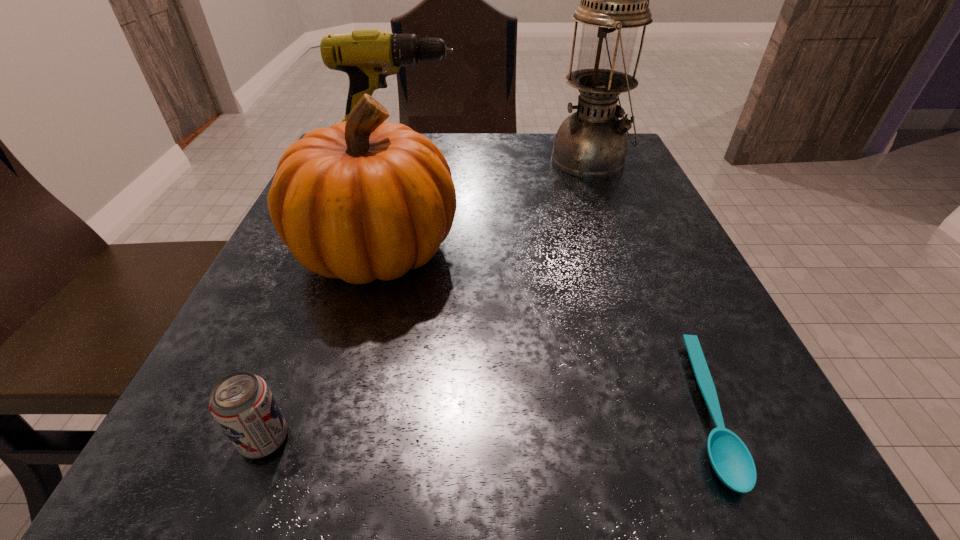
Where is `object that is the third closest to the spoon`? Image resolution: width=960 pixels, height=540 pixels. object that is the third closest to the spoon is located at coordinates (242, 404).

Find the location of `object that is the closest to the third nearest object`. object that is the closest to the third nearest object is located at coordinates (368, 56).

Identify the location of free location that satisfies the following two spatial constraints: 1. on the handle side of the drill; 2. on the back side of the spoon. (326, 410).

This screenshot has height=540, width=960. What are the coordinates of `free spot that satisfies the following two spatial constraints: 1. on the back side of the third farthest object; 2. on the handle side of the drill` in the screenshot? It's located at (402, 156).

You are a GUI agent. You are given a task and a screenshot of the screen. Output one action in this format:
    pyautogui.click(x=<x>, y=<y>)
    Task: Click on the vacant region that satisfies the following two spatial constraints: 1. on the handle side of the oil lamp; 2. on the left side of the drill
    The image size is (960, 540).
    Given the screenshot: What is the action you would take?
    pyautogui.click(x=398, y=160)

What are the coordinates of `vacant position in the image that satisfies the following two spatial constraints: 1. on the back side of the shortest object; 2. on the handle side of the drill` in the screenshot? It's located at pyautogui.click(x=596, y=156).

You are a GUI agent. You are given a task and a screenshot of the screen. Output one action in this format:
    pyautogui.click(x=<x>, y=<y>)
    Task: Click on the free spot that satisfies the following two spatial constraints: 1. on the front side of the spoon; 2. on the left side of the third nearest object
    
    Given the screenshot: What is the action you would take?
    pyautogui.click(x=331, y=410)

You are a GUI agent. You are given a task and a screenshot of the screen. Output one action in this format:
    pyautogui.click(x=<x>, y=<y>)
    Task: Click on the free location that satisfies the following two spatial constraints: 1. on the back side of the third farthest object; 2. on the handle side of the drill
    Image resolution: width=960 pixels, height=540 pixels.
    Given the screenshot: What is the action you would take?
    pyautogui.click(x=402, y=156)

Locate an element on the screen. This screenshot has height=540, width=960. free point that satisfies the following two spatial constraints: 1. on the back side of the beer can; 2. on the left side of the spoon is located at coordinates (276, 410).